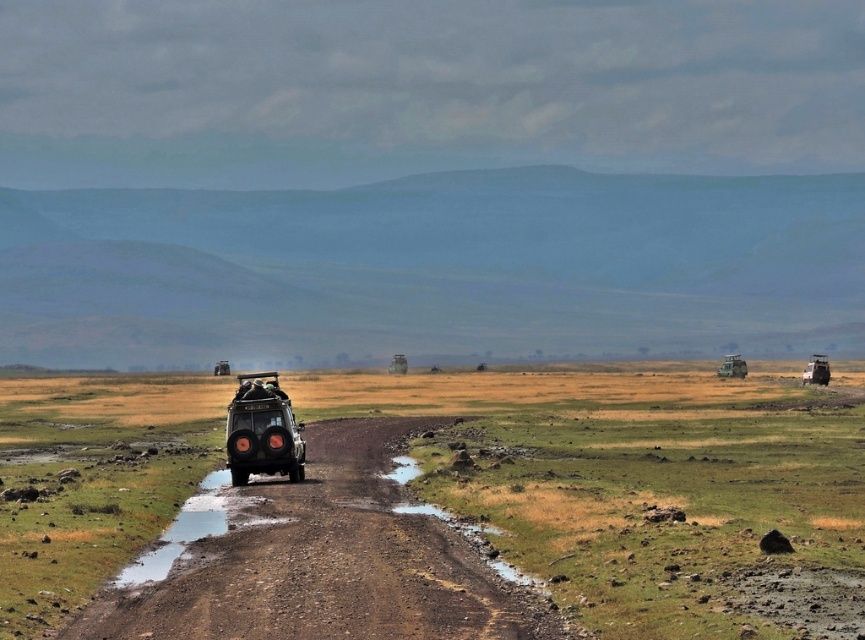
You are a photographer planning to capture a wide landscape shot of the green grassland at center and the matte black jeep at center. Based on the scene description, which object occupies a larger portion of the image in terms of width?

The green grassland at center might be wider than matte black jeep at center according to the description.